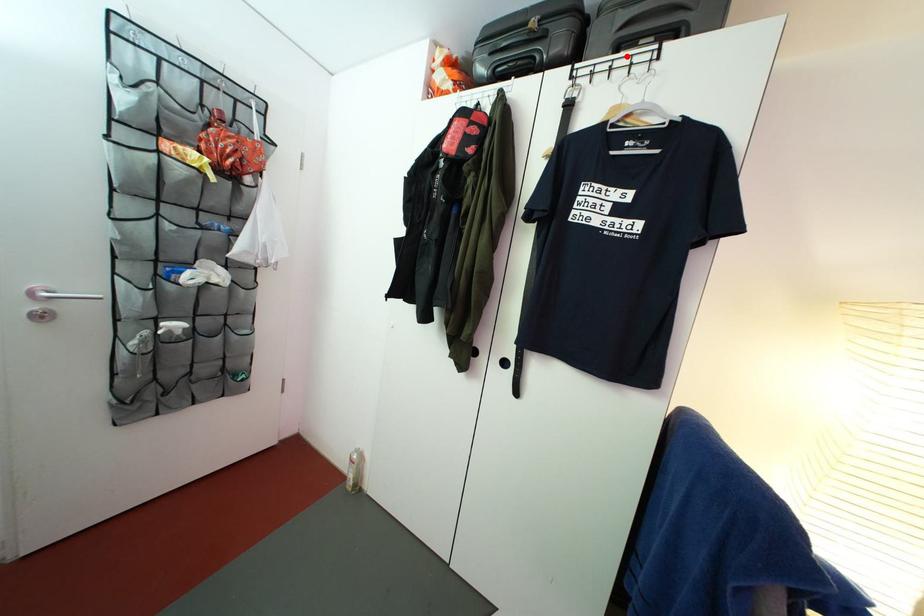
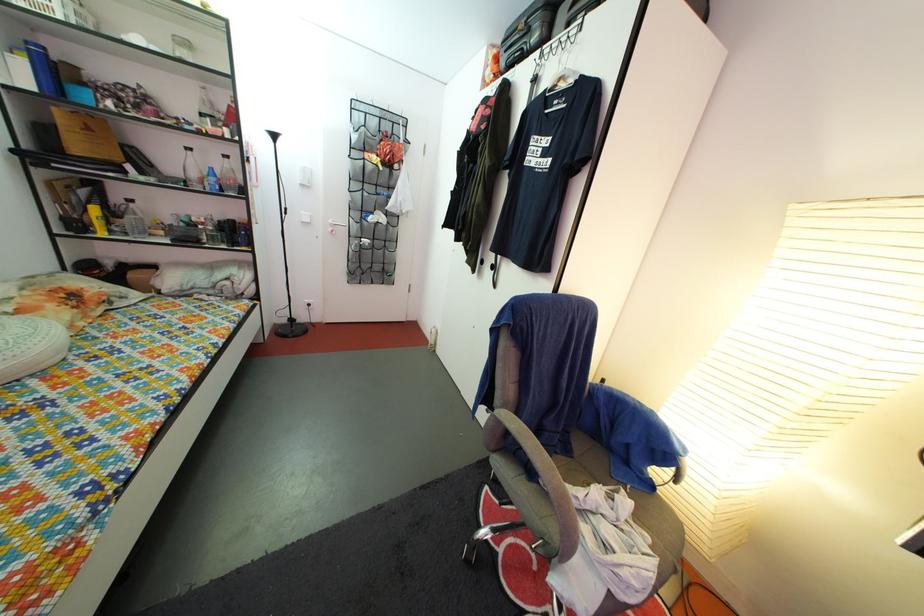
Find the pixel in the second image that matches the highlighted location in the first image.

(578, 31)